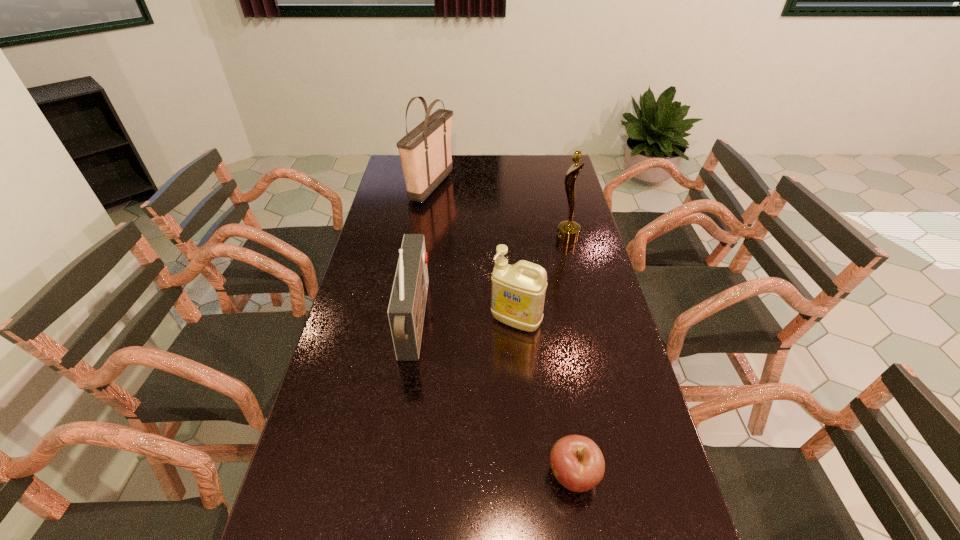
Find the location of a particular element. Image resolution: width=960 pixels, height=540 pixels. object present at the far left corner is located at coordinates (425, 152).

The height and width of the screenshot is (540, 960). I want to click on vacant space at the far edge of the desktop, so click(x=529, y=158).

In the image, there is a desktop. At what (x,y) coordinates should I click in order to perform the action: click on vacant space at the left edge. Please return your answer as a coordinate pair (x, y). The height and width of the screenshot is (540, 960). Looking at the image, I should click on pyautogui.click(x=400, y=217).

I want to click on free region at the right edge of the desktop, so click(x=550, y=218).

I want to click on free space between the second shortest object and the radio receiver, so click(466, 322).

The width and height of the screenshot is (960, 540). Find the location of `vacant area that lies between the radio receiver and the nearest object`. vacant area that lies between the radio receiver and the nearest object is located at coordinates (494, 399).

You are a GUI agent. You are given a task and a screenshot of the screen. Output one action in this format:
    pyautogui.click(x=<x>, y=<y>)
    Task: Click on the empty location between the nearest object and the fourth nearest object
    
    Given the screenshot: What is the action you would take?
    pyautogui.click(x=570, y=356)

Find the location of a particular element. free area in between the rightmost object and the farthest object is located at coordinates (499, 212).

Identify the location of free space between the nearest object and the radio receiver. The height and width of the screenshot is (540, 960). (494, 399).

In order to click on vacant region between the detergent and the shopping bag in this screenshot , I will do (x=473, y=253).